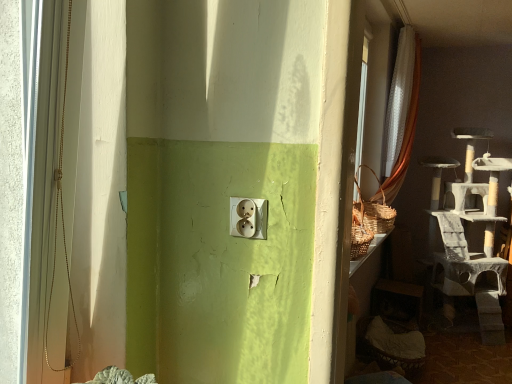
At what (x,y) coordinates should I click in order to perform the action: click on matte white outlet at center. Please return your answer as a coordinate pair (x, y). The image size is (512, 384). Looking at the image, I should click on (248, 218).

Describe the element at coordinates (248, 218) in the screenshot. This screenshot has height=384, width=512. I see `matte white outlet at center` at that location.

What is the approximate height of white sheer curtain at upper right?

It is 1.81 meters.

Where is `white sheer curtain at upper right`? white sheer curtain at upper right is located at coordinates (404, 137).

Describe the element at coordinates (404, 137) in the screenshot. The image size is (512, 384). I see `white sheer curtain at upper right` at that location.

The image size is (512, 384). I want to click on matte white outlet at center, so click(248, 218).

Consider the image. Considering the relative positions of white sheer curtain at upper right and matte white outlet at center in the image provided, is white sheer curtain at upper right to the left of matte white outlet at center from the viewer's perspective?

In fact, white sheer curtain at upper right is to the right of matte white outlet at center.

Which is behind, white sheer curtain at upper right or matte white outlet at center?

white sheer curtain at upper right.

Which point is more distant from viewer, [408,160] or [237,199]?

The point [408,160] is farther.

From the image's perspective, is white sheer curtain at upper right located above or below matte white outlet at center?

Based on their image positions, white sheer curtain at upper right is located above matte white outlet at center.

From a real-world perspective, is white sheer curtain at upper right located higher than matte white outlet at center?

Yes, from a real-world perspective, white sheer curtain at upper right is over matte white outlet at center

Based on the photo, considering the relative sizes of white sheer curtain at upper right and matte white outlet at center in the image provided, is white sheer curtain at upper right wider than matte white outlet at center?

Answer: Yes, white sheer curtain at upper right is wider than matte white outlet at center.

Is white sheer curtain at upper right taller than matte white outlet at center?

Yes, white sheer curtain at upper right is taller than matte white outlet at center.

Can you confirm if white sheer curtain at upper right is bigger than matte white outlet at center?

Indeed, white sheer curtain at upper right has a larger size compared to matte white outlet at center.

Is white sheer curtain at upper right not within matte white outlet at center?

white sheer curtain at upper right is positioned outside matte white outlet at center.

Is white sheer curtain at upper right next to matte white outlet at center and touching it?

No, white sheer curtain at upper right is not beside matte white outlet at center.

Is white sheer curtain at upper right oriented away from matte white outlet at center?

No, white sheer curtain at upper right's orientation is not away from matte white outlet at center.

How far apart are white sheer curtain at upper right and matte white outlet at center?

The distance of white sheer curtain at upper right from matte white outlet at center is 9.66 feet.

The width and height of the screenshot is (512, 384). Find the location of `electric outlet below the white sheer curtain at upper right (from a real-world perspective)`. electric outlet below the white sheer curtain at upper right (from a real-world perspective) is located at coordinates (248, 218).

Does matte white outlet at center appear on the right side of white sheer curtain at upper right?

No, matte white outlet at center is not to the right of white sheer curtain at upper right.

In the image, is matte white outlet at center positioned in front of or behind white sheer curtain at upper right?

matte white outlet at center is in front of white sheer curtain at upper right.

Is point (231, 197) more distant than point (417, 62)?

No, it is in front of (417, 62).

From the image's perspective, which is below, matte white outlet at center or white sheer curtain at upper right?

From the image's view, matte white outlet at center is below.

From a real-world perspective, is matte white outlet at center located beneath white sheer curtain at upper right?

Yes, from a real-world perspective, matte white outlet at center is under white sheer curtain at upper right.

Considering the relative sizes of matte white outlet at center and white sheer curtain at upper right in the image provided, is matte white outlet at center wider than white sheer curtain at upper right?

Incorrect, the width of matte white outlet at center does not surpass that of white sheer curtain at upper right.

Does matte white outlet at center have a lesser height compared to white sheer curtain at upper right?

Answer: Indeed, matte white outlet at center has a lesser height compared to white sheer curtain at upper right.

Considering the relative sizes of matte white outlet at center and white sheer curtain at upper right in the image provided, is matte white outlet at center smaller than white sheer curtain at upper right?

Yes.

Which is correct: matte white outlet at center is inside white sheer curtain at upper right, or outside of it?

matte white outlet at center is spatially situated outside white sheer curtain at upper right.

Is matte white outlet at center far from white sheer curtain at upper right?

Yes, matte white outlet at center is far from white sheer curtain at upper right.

Is matte white outlet at center oriented away from white sheer curtain at upper right?

Yes, white sheer curtain at upper right is at the back of matte white outlet at center.

How many degrees apart are the facing directions of matte white outlet at center and white sheer curtain at upper right?

matte white outlet at center and white sheer curtain at upper right are facing 88.8 degrees away from each other.

The image size is (512, 384). I want to click on curtain on the right of matte white outlet at center, so click(x=404, y=137).

The width and height of the screenshot is (512, 384). In order to click on curtain that is above the matte white outlet at center (from a real-world perspective) in this screenshot , I will do `click(404, 137)`.

The width and height of the screenshot is (512, 384). What are the coordinates of `electric outlet below the white sheer curtain at upper right (from the image's perspective)` in the screenshot? It's located at tap(248, 218).